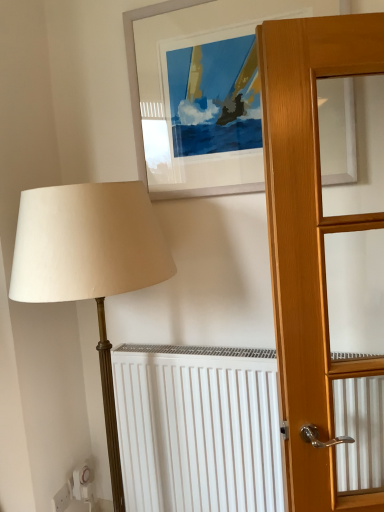
Question: Is white matte picture frame at upper center to the left or to the right of white plastic electric outlet at lower left in the image?

Choices:
 (A) right
 (B) left

Answer: (A)

Question: In terms of width, does white matte picture frame at upper center look wider or thinner when compared to white plastic electric outlet at lower left?

Choices:
 (A) thin
 (B) wide

Answer: (B)

Question: Considering their positions, is white matte picture frame at upper center located in front of or behind white plastic electric outlet at lower left?

Choices:
 (A) front
 (B) behind

Answer: (A)

Question: In terms of size, does white plastic electric outlet at lower left appear bigger or smaller than white matte picture frame at upper center?

Choices:
 (A) big
 (B) small

Answer: (B)

Question: Would you say white plastic electric outlet at lower left is inside or outside white matte picture frame at upper center?

Choices:
 (A) inside
 (B) outside

Answer: (B)

Question: From a real-world perspective, is white plastic electric outlet at lower left above or below white matte picture frame at upper center?

Choices:
 (A) above
 (B) below

Answer: (B)

Question: Is white plastic electric outlet at lower left taller or shorter than white matte picture frame at upper center?

Choices:
 (A) tall
 (B) short

Answer: (B)